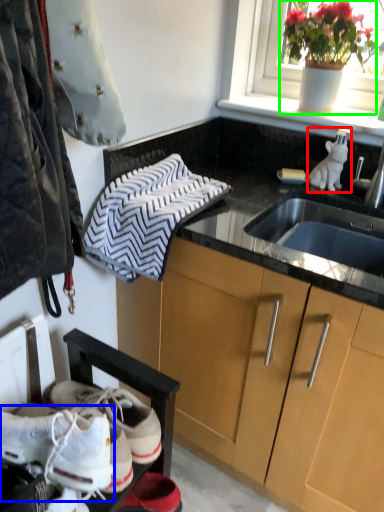
Question: Considering the real-world distances, which object is closest to animal (highlighted by a red box)? footwear (highlighted by a blue box) or houseplant (highlighted by a green box).

Choices:
 (A) footwear
 (B) houseplant

Answer: (B)